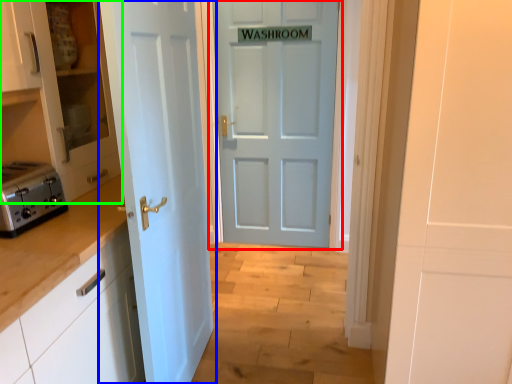
Question: Which is nearer to the door (highlighted by a red box)? door (highlighted by a blue box) or cabinetry (highlighted by a green box).

Choices:
 (A) door
 (B) cabinetry

Answer: (A)